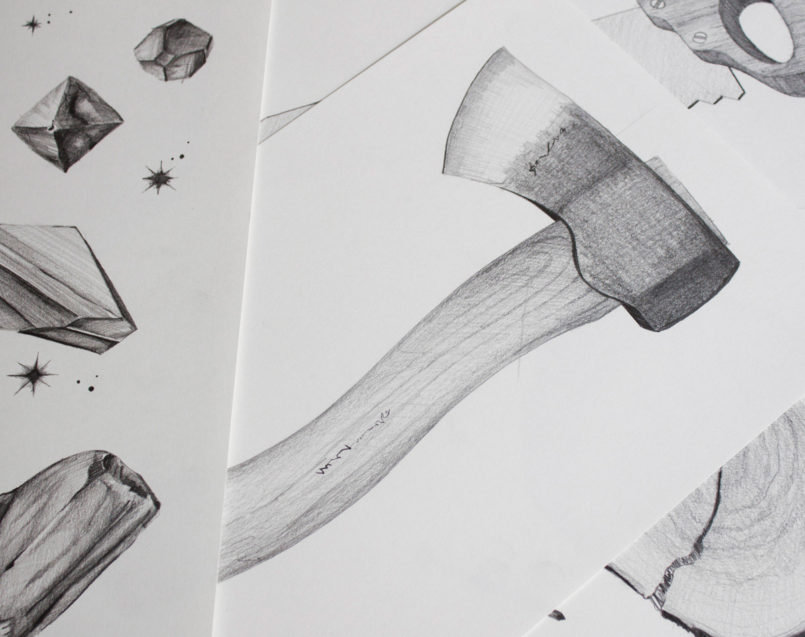
Find the location of a particular element. Image resolution: width=805 pixels, height=637 pixels. different papers is located at coordinates (150, 264), (324, 276), (378, 43), (614, 619).